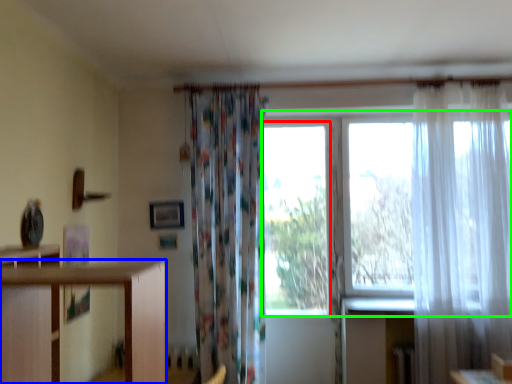
Question: Based on their relative distances, which object is nearer to window (highlighted by a red box)? Choose from furniture (highlighted by a blue box) and window screen (highlighted by a green box).

Choices:
 (A) furniture
 (B) window screen

Answer: (B)